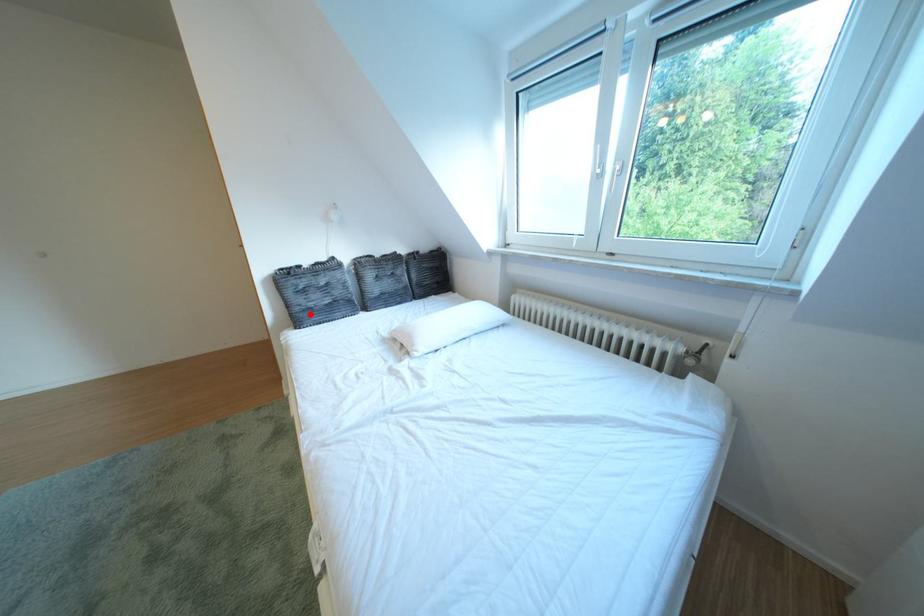
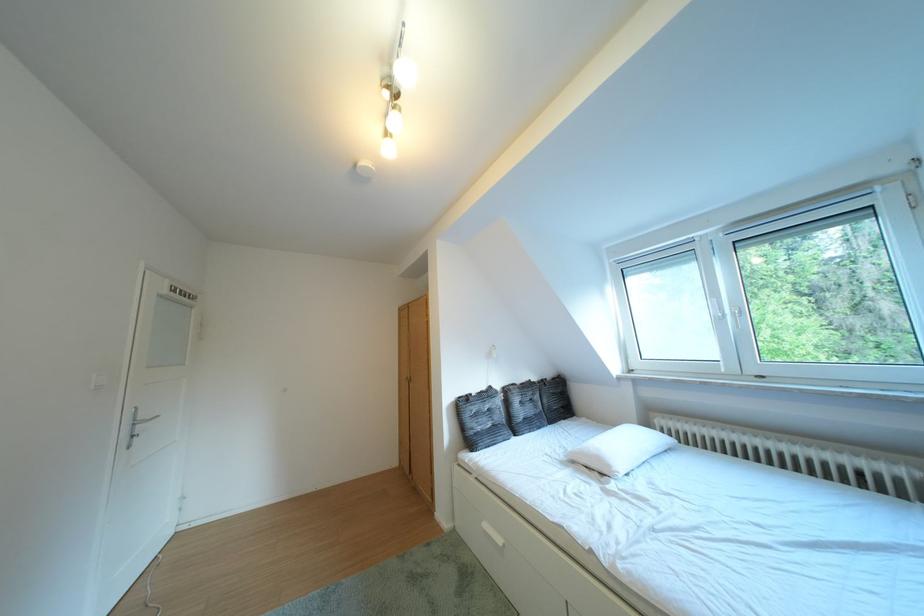
Question: A red point is marked in image1. In image2, is the corresponding 3D point closer to the camera or farther? Reply with the corresponding letter.

Choices:
 (A) The corresponding 3D point is closer.
 (B) The corresponding 3D point is farther.

Answer: (B)